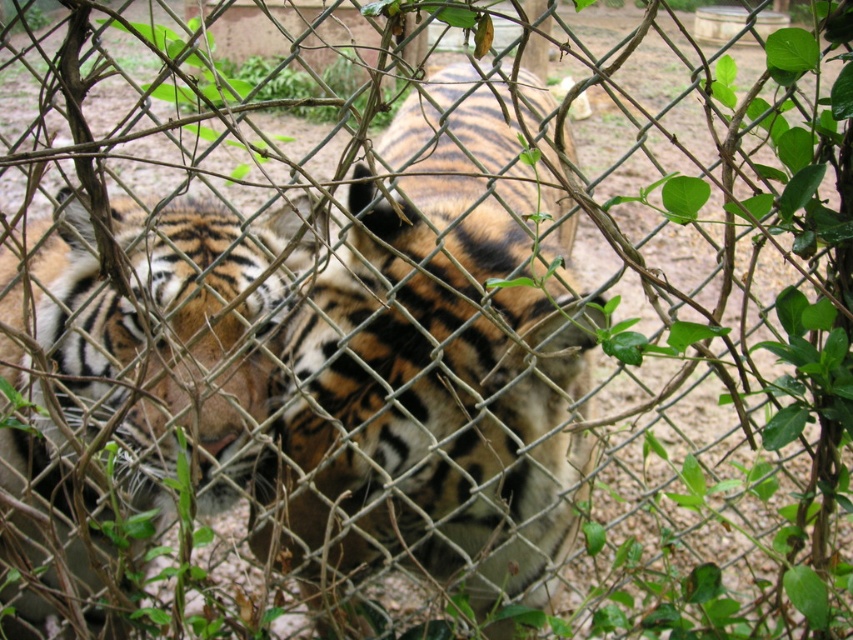
Question: Does orange-brown fur tiger at center have a larger size compared to orange-brown fur tiger at left?

Choices:
 (A) yes
 (B) no

Answer: (A)

Question: Does orange-brown fur tiger at center have a greater width compared to orange-brown fur tiger at left?

Choices:
 (A) yes
 (B) no

Answer: (B)

Question: Does orange-brown fur tiger at center appear under orange-brown fur tiger at left?

Choices:
 (A) no
 (B) yes

Answer: (A)